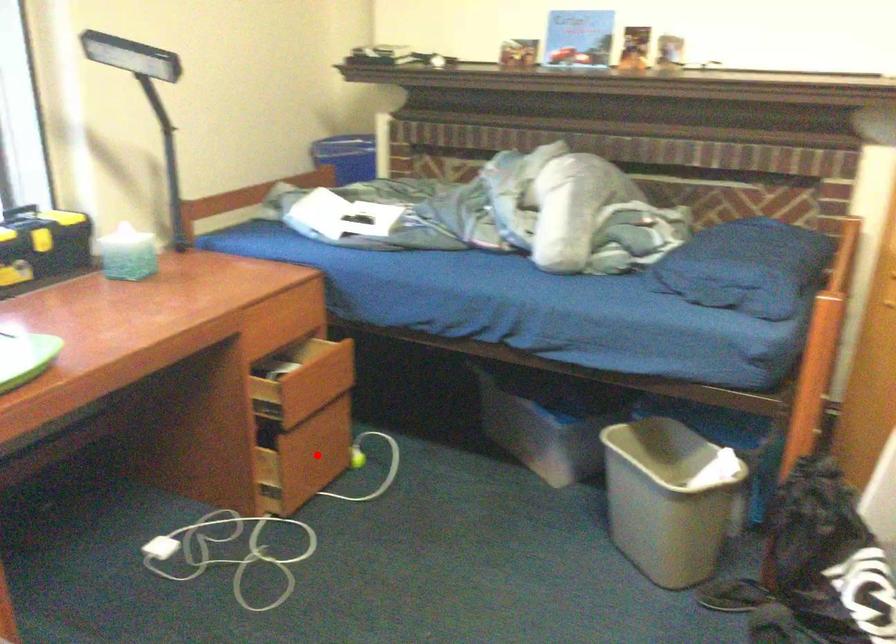
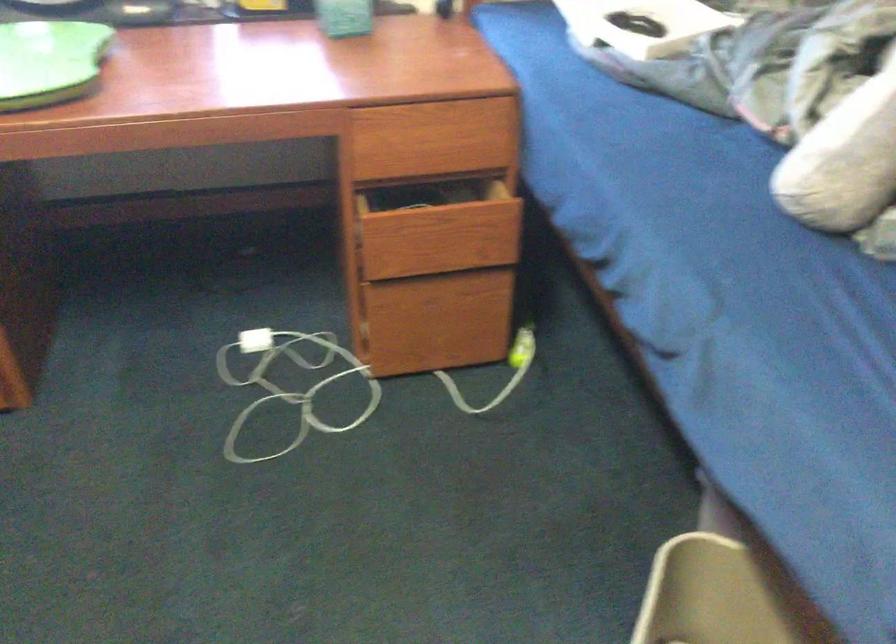
Question: I am providing you with two images of the same scene from different viewpoints. Given a red point in image1, look at the same physical point in image2. Is it:

Choices:
 (A) Closer to the viewpoint
 (B) Farther from the viewpoint

Answer: (A)